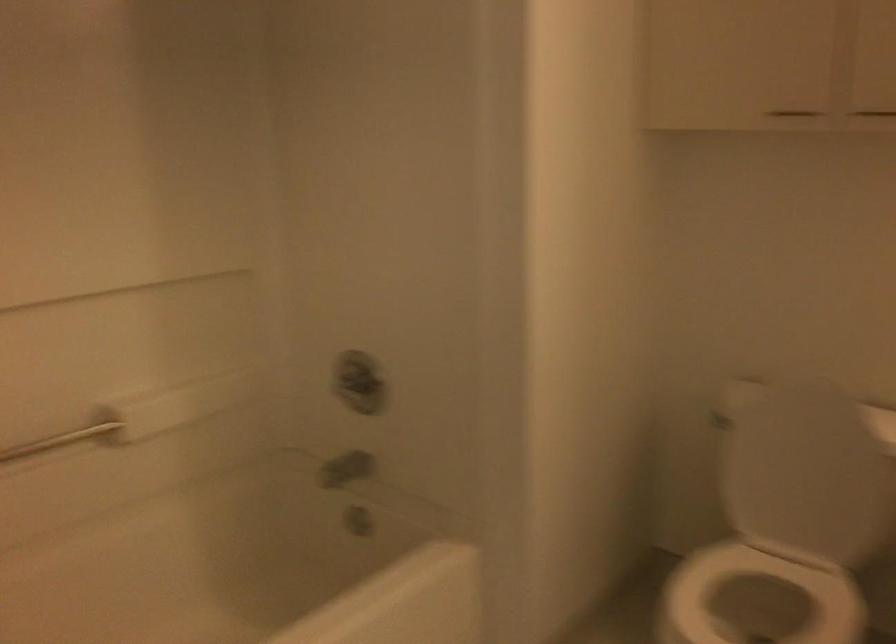
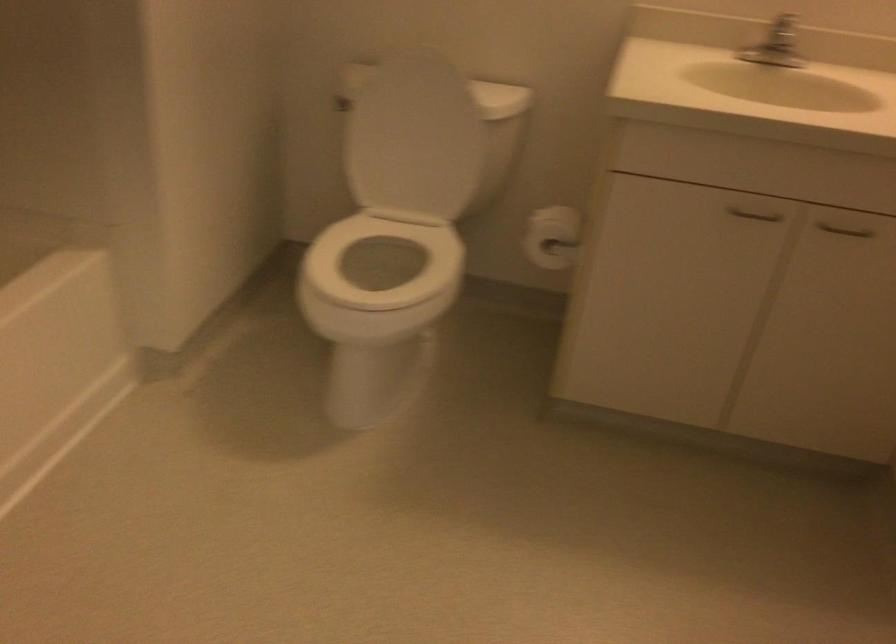
Where in the second image is the point corresponding to point (823, 386) from the first image?

(440, 61)